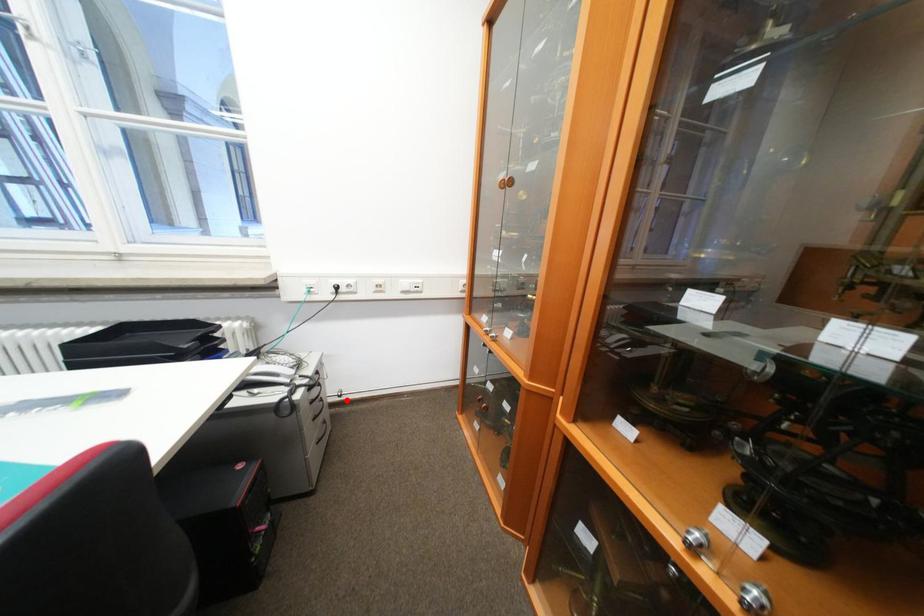
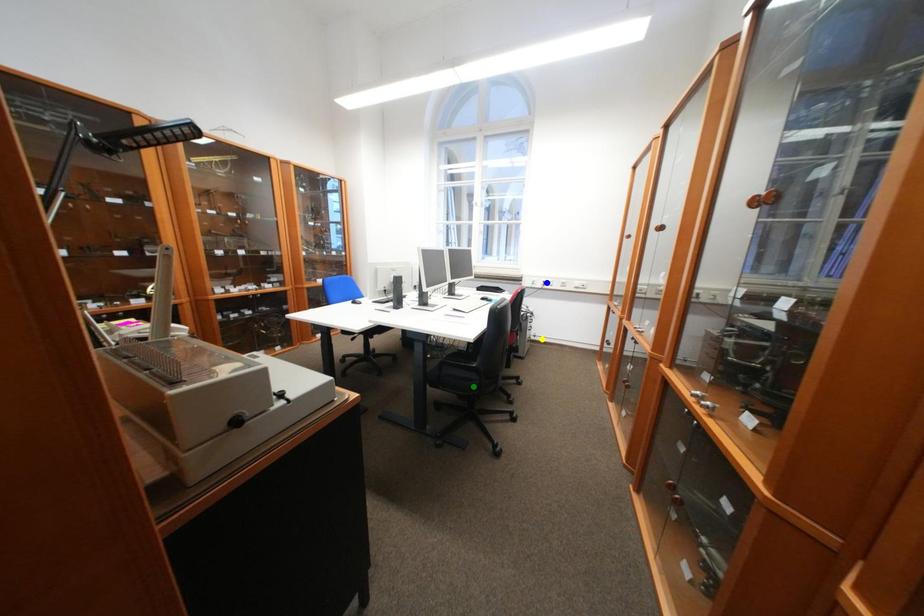
Question: I am providing you with two images of the same scene from different viewpoints. A red point is marked on the first image. You are given multiple points on the second image. Can you choose the point in image 2 that corresponds to the point in image 1?

Choices:
 (A) yellow point
 (B) blue point
 (C) green point

Answer: (A)